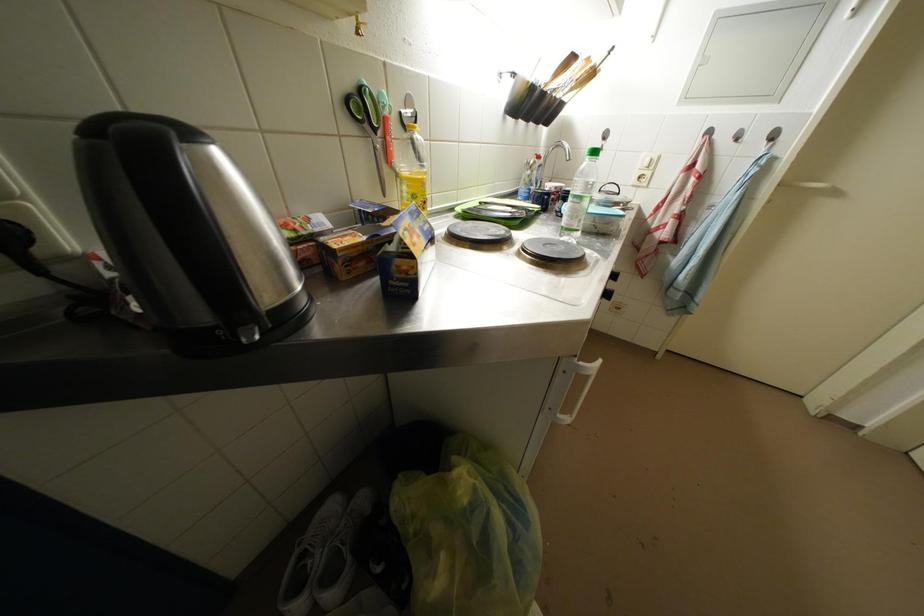
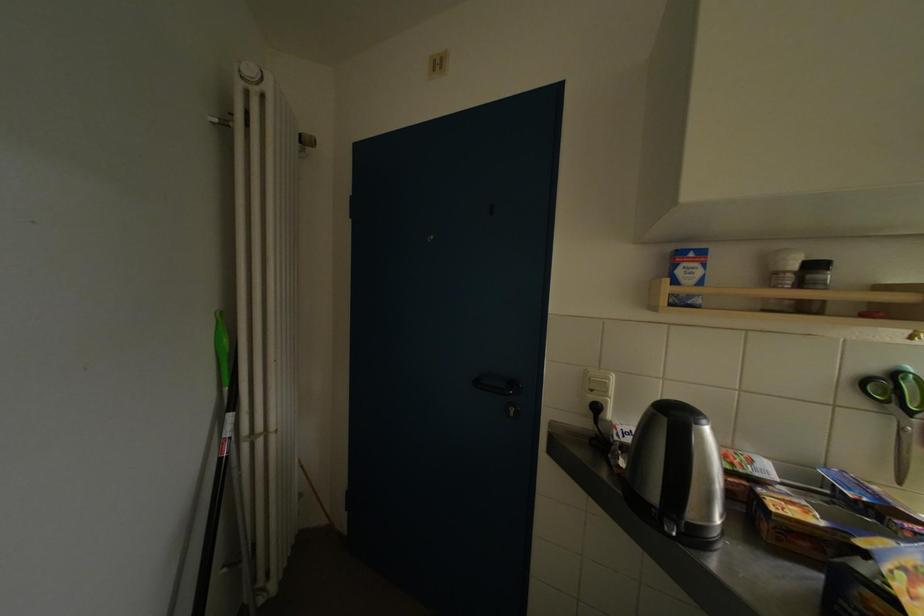
In the second image, find the point that corresponds to the point at 225,336 in the first image.

(661, 514)